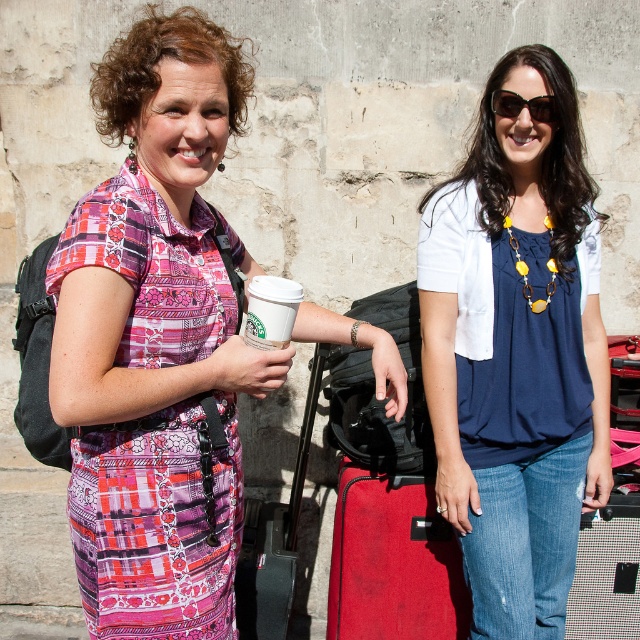
Question: Is matte pink dress at center positioned behind navy blue fabric shirt at center?

Choices:
 (A) no
 (B) yes

Answer: (A)

Question: Which object is the closest to the navy blue fabric shirt at center?

Choices:
 (A) matte pink dress at center
 (B) white paper cup at center
 (C) matte black suitcase at center
 (D) sunglasses at upper center

Answer: (D)

Question: Can you confirm if white paper cup at center is smaller than sunglasses at upper center?

Choices:
 (A) yes
 (B) no

Answer: (B)

Question: Which object appears closest to the camera in this image?

Choices:
 (A) white paper cup at center
 (B) navy blue fabric shirt at center
 (C) matte pink dress at center
 (D) matte black suitcase at center

Answer: (C)

Question: Among these objects, which one is nearest to the camera?

Choices:
 (A) matte black suitcase at center
 (B) sunglasses at upper center

Answer: (B)

Question: Is navy blue fabric shirt at center positioned in front of matte black suitcase at center?

Choices:
 (A) no
 (B) yes

Answer: (B)